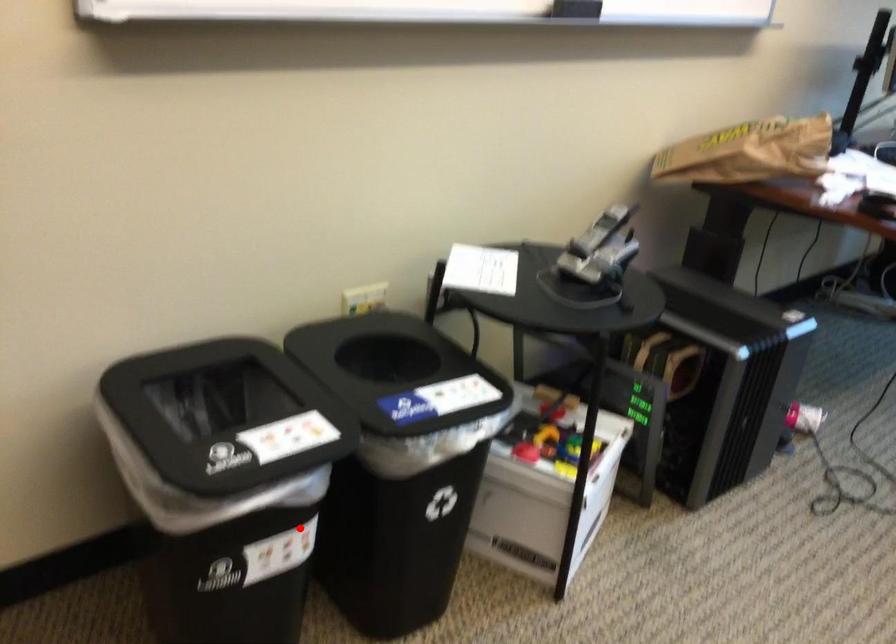
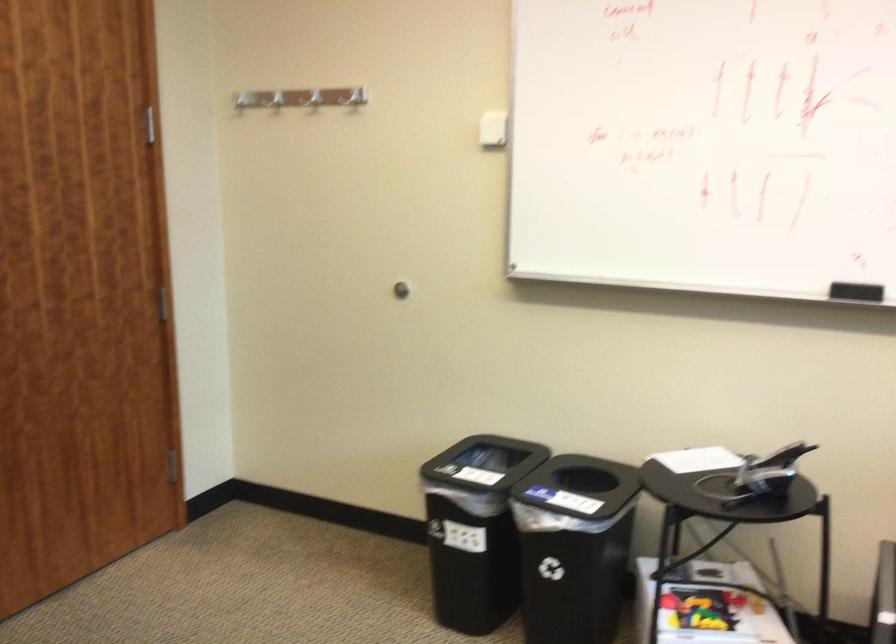
Question: I am providing you with two images of the same scene from different viewpoints. A red point is shown in image1. For the corresponding object point in image2, is it positioned nearer or farther from the camera?

Choices:
 (A) Nearer
 (B) Farther

Answer: (B)